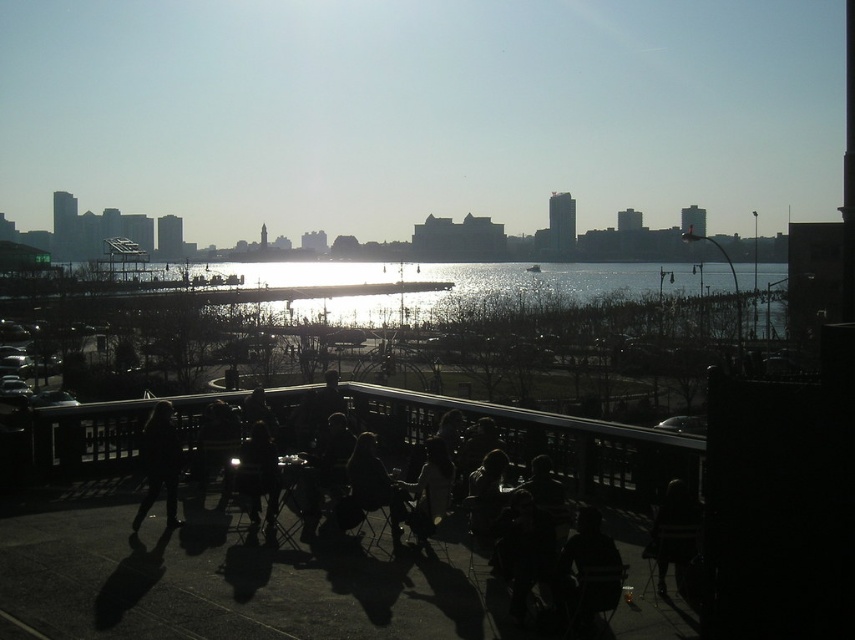
Question: Does black leather jacket at lower left appear on the right side of dark fabric jacket at center?

Choices:
 (A) yes
 (B) no

Answer: (B)

Question: Estimate the real-world distances between objects in this image. Which object is closer to the dark fabric chair at center?

Choices:
 (A) silvery reflective water at center
 (B) dark fabric jacket at center
 (C) black metal rail at lower center

Answer: (B)

Question: Which object is the closest to the dark fabric chair at center?

Choices:
 (A) black metal rail at lower center
 (B) dark fabric jacket at center
 (C) black leather jacket at lower left
 (D) silvery reflective water at center

Answer: (B)

Question: Considering the relative positions of silvery reflective water at center and black leather jacket at lower left in the image provided, where is silvery reflective water at center located with respect to black leather jacket at lower left?

Choices:
 (A) left
 (B) right

Answer: (B)

Question: In this image, where is black metal rail at lower center located relative to silvery reflective water at center?

Choices:
 (A) right
 (B) left

Answer: (B)

Question: Which point appears farthest from the camera in this image?

Choices:
 (A) (x=437, y=500)
 (B) (x=419, y=410)

Answer: (B)